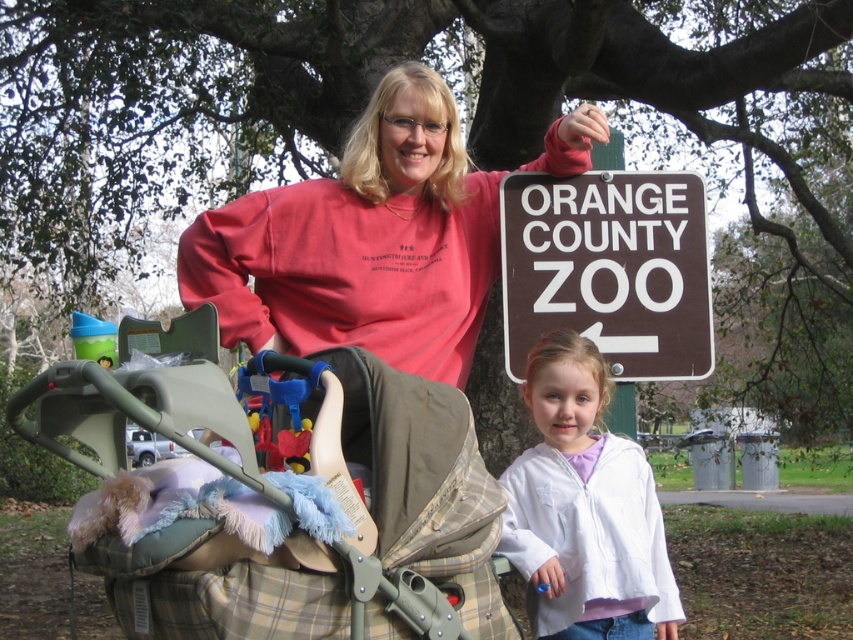
Question: Can you confirm if plaid fabric baby carriage at center is bigger than white fleece jacket at lower right?

Choices:
 (A) yes
 (B) no

Answer: (A)

Question: Which of the following is the closest to the observer?

Choices:
 (A) tap(399, 108)
 (B) tap(585, 320)

Answer: (A)

Question: Can you confirm if plaid fabric baby carriage at center is positioned to the right of white fleece jacket at lower right?

Choices:
 (A) yes
 (B) no

Answer: (B)

Question: Which point is closer to the camera?

Choices:
 (A) (506, 205)
 (B) (395, 145)

Answer: (B)

Question: Is matte pink sweatshirt at center above white fleece jacket at lower right?

Choices:
 (A) no
 (B) yes

Answer: (B)

Question: Which object is the closest to the matte pink sweatshirt at center?

Choices:
 (A) brownmaterial/texturesign at upper right
 (B) plaid fabric baby carriage at center

Answer: (A)